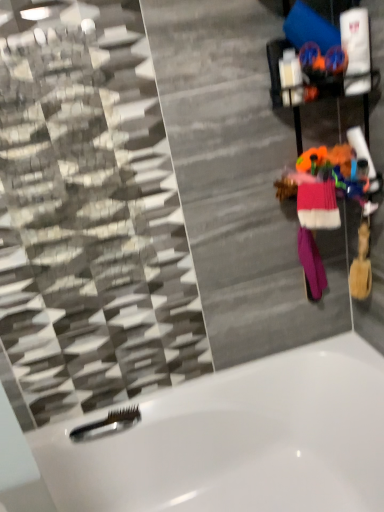
Find the location of a particular element. This screenshot has width=384, height=512. white glossy bathtub at lower center is located at coordinates (220, 442).

The height and width of the screenshot is (512, 384). What do you see at coordinates (220, 442) in the screenshot?
I see `white glossy bathtub at lower center` at bounding box center [220, 442].

How much space does purple knitted mittens at right, placed as the 1th clothing when sorted from back to front, occupy horizontally?

purple knitted mittens at right, placed as the 1th clothing when sorted from back to front, is 7.19 centimeters wide.

I want to click on white glossy bathtub at lower center, so click(x=220, y=442).

Considering the points (95, 434) and (214, 461), which point is in front, point (95, 434) or point (214, 461)?

Positioned in front is point (95, 434).

Could you tell me if black plastic comb at lower left is turned towards white glossy bathtub at lower center?

Yes, black plastic comb at lower left is facing white glossy bathtub at lower center.

Can you see black plastic comb at lower left touching white glossy bathtub at lower center?

black plastic comb at lower left is not next to white glossy bathtub at lower center, and they're not touching.

How much distance is there between black plastic comb at lower left and white glossy bathtub at lower center?

black plastic comb at lower left is 13.84 inches from white glossy bathtub at lower center.

Consider the image. Are black plastic comb at lower left and purple knitted mittens at right, which ranks as the 2th clothing in front-to-back order, beside each other?

No, black plastic comb at lower left is not next to purple knitted mittens at right, which ranks as the 2th clothing in front-to-back order.

Which object is further away from the camera, black plastic comb at lower left or purple knitted mittens at right, placed as the 1th clothing when sorted from back to front?

black plastic comb at lower left.

In the scene shown: Is black plastic comb at lower left oriented away from purple knitted mittens at right, placed as the 1th clothing when sorted from back to front?

No.

In terms of height, does black plastic comb at lower left look taller or shorter compared to purple knitted mittens at right, which ranks as the 2th clothing in front-to-back order?

Considering their sizes, black plastic comb at lower left has less height than purple knitted mittens at right, which ranks as the 2th clothing in front-to-back order.

Is white glossy bathtub at lower center spatially inside black plastic comb at lower left, or outside of it?

white glossy bathtub at lower center cannot be found inside black plastic comb at lower left.

From the image's perspective, who appears lower, white glossy bathtub at lower center or black plastic comb at lower left?

white glossy bathtub at lower center appears lower in the image.

Which object is wider, white glossy bathtub at lower center or black plastic comb at lower left?

Wider between the two is white glossy bathtub at lower center.

Measure the distance between purple knitted mittens at right, which ranks as the 2th clothing in front-to-back order, and black plastic comb at lower left.

They are 29.12 inches apart.

Can we say purple knitted mittens at right, which ranks as the 2th clothing in front-to-back order, lies outside black plastic comb at lower left?

Yes, purple knitted mittens at right, which ranks as the 2th clothing in front-to-back order, is outside of black plastic comb at lower left.

Where is `shower that appears on the left of purple knitted mittens at right, placed as the 1th clothing when sorted from back to front`? shower that appears on the left of purple knitted mittens at right, placed as the 1th clothing when sorted from back to front is located at coordinates (107, 423).

Does purple knitted mittens at right, which ranks as the 2th clothing in front-to-back order, have a lesser width compared to black plastic comb at lower left?

Incorrect, the width of purple knitted mittens at right, which ranks as the 2th clothing in front-to-back order, is not less than that of black plastic comb at lower left.

From a real-world perspective, relative to purple knitted mittens at right, placed as the 1th clothing when sorted from back to front, is pink knitted sweater at right, which is counted as the second clothing, starting from the back, vertically above or below?

In terms of real-world spatial position, pink knitted sweater at right, which is counted as the second clothing, starting from the back, is above purple knitted mittens at right, placed as the 1th clothing when sorted from back to front.

Is pink knitted sweater at right, which is counted as the second clothing, starting from the back, next to purple knitted mittens at right, placed as the 1th clothing when sorted from back to front, and touching it?

No, pink knitted sweater at right, which is counted as the second clothing, starting from the back, is not making contact with purple knitted mittens at right, placed as the 1th clothing when sorted from back to front.

Who is taller, pink knitted sweater at right, the 1th clothing viewed from the front, or purple knitted mittens at right, which ranks as the 2th clothing in front-to-back order?

Standing taller between the two is purple knitted mittens at right, which ranks as the 2th clothing in front-to-back order.

Which of these two, pink knitted sweater at right, the 1th clothing viewed from the front, or purple knitted mittens at right, placed as the 1th clothing when sorted from back to front, is bigger?

purple knitted mittens at right, placed as the 1th clothing when sorted from back to front, is bigger.

From a real-world perspective, does pink knitted sweater at right, which is counted as the second clothing, starting from the back, sit lower than black plastic comb at lower left?

Actually, pink knitted sweater at right, which is counted as the second clothing, starting from the back, is physically above black plastic comb at lower left in the real world.

Who is bigger, pink knitted sweater at right, the 1th clothing viewed from the front, or black plastic comb at lower left?

Bigger between the two is pink knitted sweater at right, the 1th clothing viewed from the front.

Relative to black plastic comb at lower left, is pink knitted sweater at right, the 1th clothing viewed from the front, in front or behind?

In the image, pink knitted sweater at right, the 1th clothing viewed from the front, appears in front of black plastic comb at lower left.

From the image's perspective, between pink knitted sweater at right, the 1th clothing viewed from the front, and black plastic comb at lower left, who is located below?

black plastic comb at lower left is shown below in the image.

Between purple knitted mittens at right, placed as the 1th clothing when sorted from back to front, and pink knitted sweater at right, which is counted as the second clothing, starting from the back, which one has larger width?

With larger width is purple knitted mittens at right, placed as the 1th clothing when sorted from back to front.

What's the angular difference between purple knitted mittens at right, which ranks as the 2th clothing in front-to-back order, and pink knitted sweater at right, which is counted as the second clothing, starting from the back,'s facing directions?

There is a 79.9-degree angle between the facing directions of purple knitted mittens at right, which ranks as the 2th clothing in front-to-back order, and pink knitted sweater at right, which is counted as the second clothing, starting from the back.

Is point (320, 270) less distant than point (306, 215)?

No, (320, 270) is further to viewer.

From the image's perspective, is purple knitted mittens at right, placed as the 1th clothing when sorted from back to front, beneath pink knitted sweater at right, which is counted as the second clothing, starting from the back?

Correct, purple knitted mittens at right, placed as the 1th clothing when sorted from back to front, appears lower than pink knitted sweater at right, which is counted as the second clothing, starting from the back, in the image.

The image size is (384, 512). In the image, there is a white glossy bathtub at lower center. In order to click on shower above it (from the image's perspective) in this screenshot , I will do `click(107, 423)`.

Identify the location of shower directly beneath the purple knitted mittens at right, placed as the 1th clothing when sorted from back to front (from a real-world perspective). (107, 423).

From the image, which object appears to be farther from pink knitted sweater at right, which is counted as the second clothing, starting from the back, black plastic comb at lower left or white glossy bathtub at lower center?

black plastic comb at lower left lies further to pink knitted sweater at right, which is counted as the second clothing, starting from the back, than the other object.

Estimate the real-world distances between objects in this image. Which object is further from pink knitted sweater at right, the 1th clothing viewed from the front, white glossy bathtub at lower center or purple knitted mittens at right, which ranks as the 2th clothing in front-to-back order?

Among the two, white glossy bathtub at lower center is located further to pink knitted sweater at right, the 1th clothing viewed from the front.

From the picture: Based on their spatial positions, is white glossy bathtub at lower center or purple knitted mittens at right, placed as the 1th clothing when sorted from back to front, closer to black plastic comb at lower left?

white glossy bathtub at lower center.

Based on their spatial positions, is black plastic comb at lower left or pink knitted sweater at right, the 1th clothing viewed from the front, closer to white glossy bathtub at lower center?

black plastic comb at lower left is closer to white glossy bathtub at lower center.

Estimate the real-world distances between objects in this image. Which object is further from purple knitted mittens at right, which ranks as the 2th clothing in front-to-back order, black plastic comb at lower left or pink knitted sweater at right, which is counted as the second clothing, starting from the back?

Among the two, black plastic comb at lower left is located further to purple knitted mittens at right, which ranks as the 2th clothing in front-to-back order.

From the picture: Based on their spatial positions, is purple knitted mittens at right, placed as the 1th clothing when sorted from back to front, or black plastic comb at lower left closer to pink knitted sweater at right, the 1th clothing viewed from the front?

The object closer to pink knitted sweater at right, the 1th clothing viewed from the front, is purple knitted mittens at right, placed as the 1th clothing when sorted from back to front.

When comparing their distances from purple knitted mittens at right, which ranks as the 2th clothing in front-to-back order, does pink knitted sweater at right, the 1th clothing viewed from the front, or black plastic comb at lower left seem closer?

pink knitted sweater at right, the 1th clothing viewed from the front, is closer to purple knitted mittens at right, which ranks as the 2th clothing in front-to-back order.

Looking at the image, which one is located further to black plastic comb at lower left, pink knitted sweater at right, which is counted as the second clothing, starting from the back, or purple knitted mittens at right, placed as the 1th clothing when sorted from back to front?

pink knitted sweater at right, which is counted as the second clothing, starting from the back, lies further to black plastic comb at lower left than the other object.

This screenshot has width=384, height=512. Identify the location of clothing situated between black plastic comb at lower left and purple knitted mittens at right, which ranks as the 2th clothing in front-to-back order, from left to right. (318, 205).

Where is `shower between purple knitted mittens at right, which ranks as the 2th clothing in front-to-back order, and white glossy bathtub at lower center in the up-down direction`? Image resolution: width=384 pixels, height=512 pixels. shower between purple knitted mittens at right, which ranks as the 2th clothing in front-to-back order, and white glossy bathtub at lower center in the up-down direction is located at coordinates (107, 423).

The image size is (384, 512). I want to click on shower that lies between pink knitted sweater at right, the 1th clothing viewed from the front, and white glossy bathtub at lower center from top to bottom, so click(107, 423).

Identify the location of clothing between pink knitted sweater at right, which is counted as the second clothing, starting from the back, and white glossy bathtub at lower center in the up-down direction. The height and width of the screenshot is (512, 384). (311, 265).